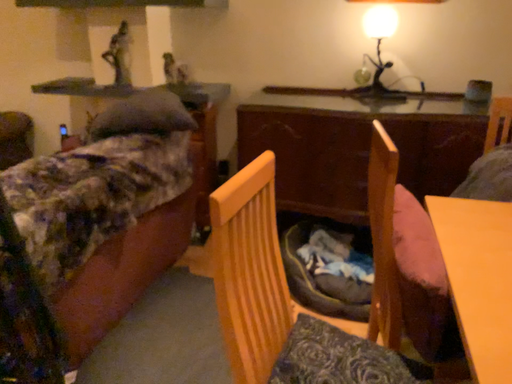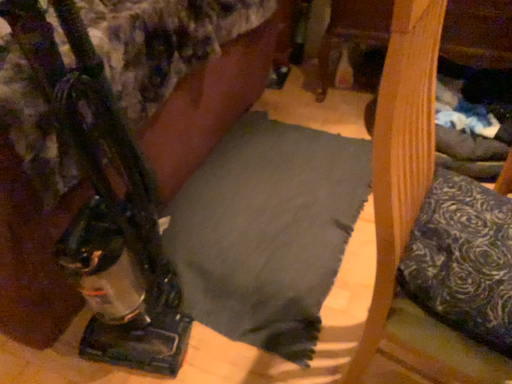
Question: How did the camera likely rotate when shooting the video?

Choices:
 (A) rotated left
 (B) rotated right

Answer: (A)